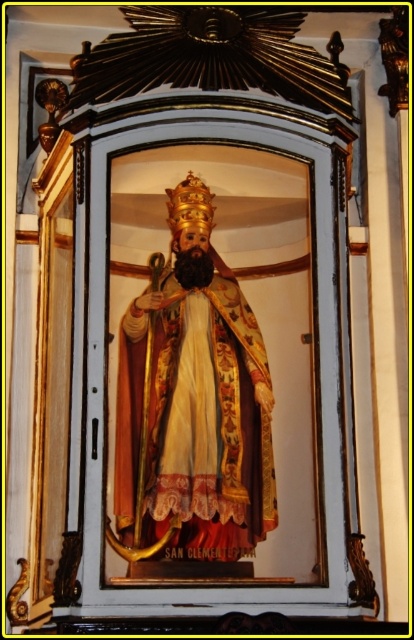
Does point (262, 467) come farther from viewer compared to point (173, 202)?

No.

In the scene shown: Is goldmaterial/texture statue at center positioned in front of gold textured crown at center?

Yes, it is in front of gold textured crown at center.

The image size is (414, 640). Describe the element at coordinates (192, 403) in the screenshot. I see `goldmaterial/texture statue at center` at that location.

Find the location of a particular element. The width and height of the screenshot is (414, 640). goldmaterial/texture statue at center is located at coordinates (192, 403).